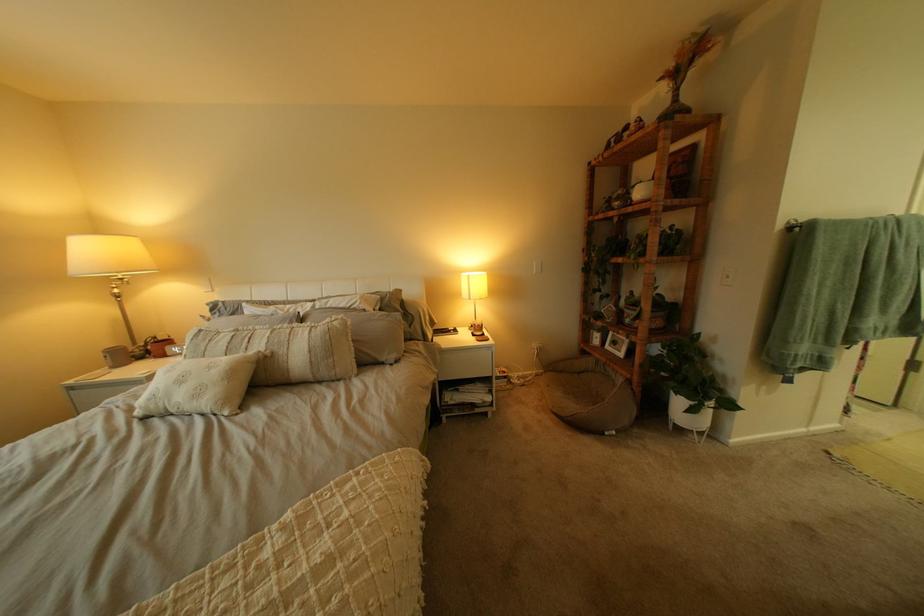
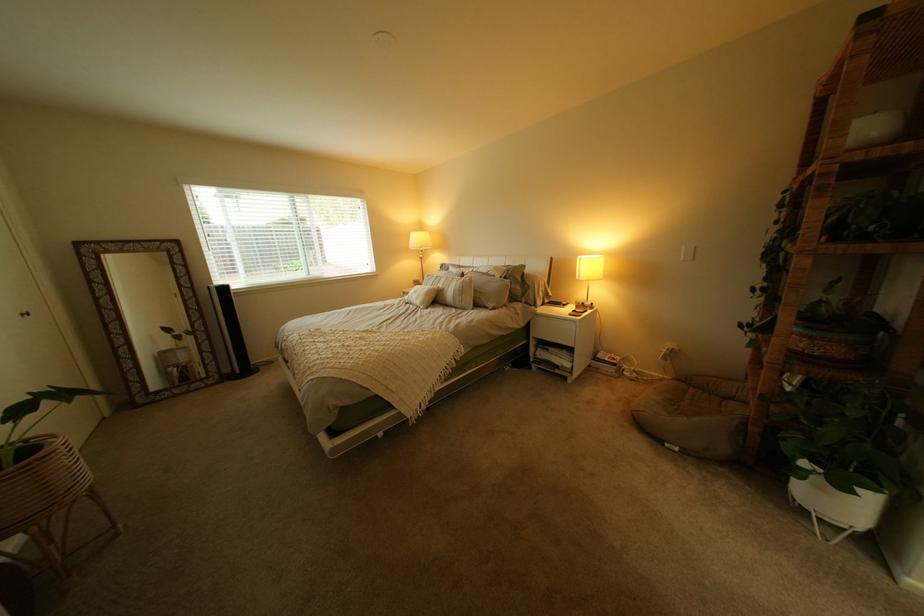
In the second image, find the point that corresponds to pixel 349 323 in the first image.

(482, 280)